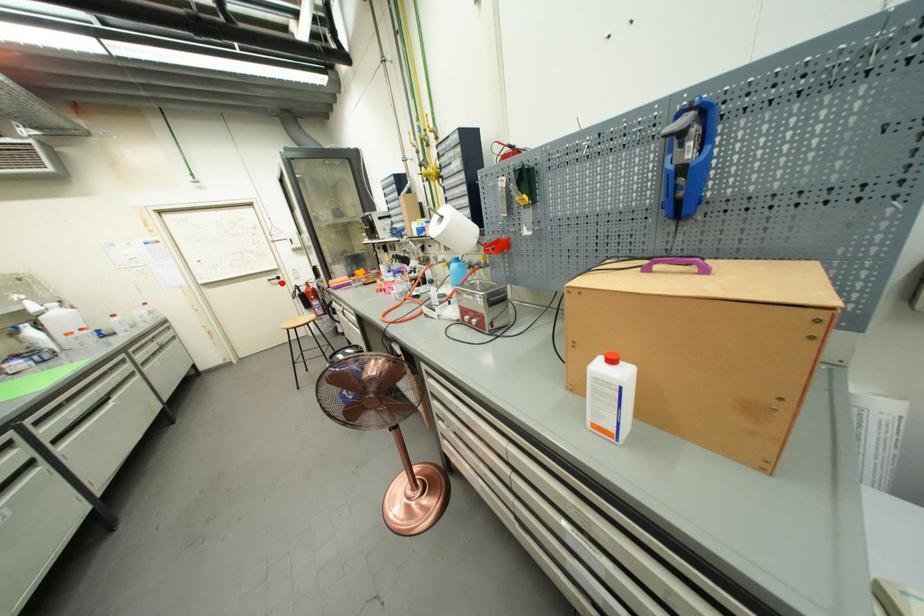
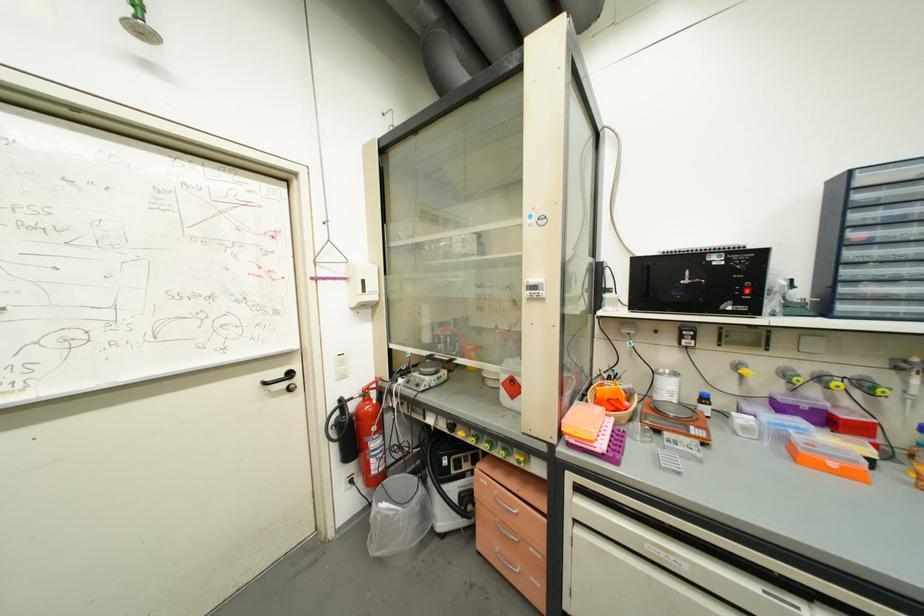
Question: I am providing you with two images of the same scene from different viewpoints. A red point is marked on the first image. At the location where the point appears in image 1, is it still visible in image 2?

Choices:
 (A) Yes
 (B) No

Answer: (A)